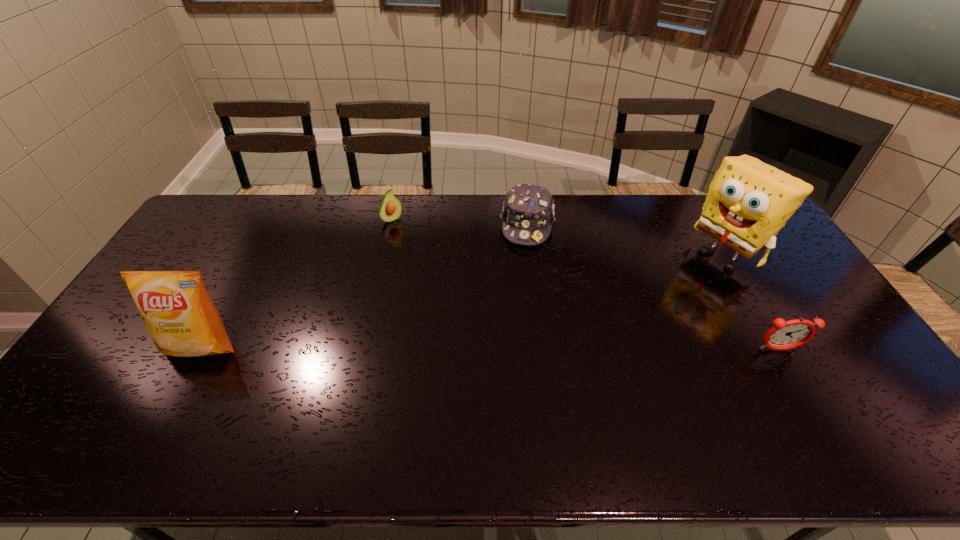
This screenshot has width=960, height=540. In order to click on the second tallest object in this screenshot , I will do `click(175, 306)`.

Where is `crisp (potato chip)`? This screenshot has height=540, width=960. crisp (potato chip) is located at coordinates (175, 306).

Where is `alarm clock`? alarm clock is located at coordinates (785, 335).

Image resolution: width=960 pixels, height=540 pixels. I want to click on avocado, so click(390, 208).

Image resolution: width=960 pixels, height=540 pixels. In order to click on the tallest object in this screenshot , I will do (x=748, y=202).

Where is `the third object from left to right`? the third object from left to right is located at coordinates click(528, 212).

Find the location of a particular element. This screenshot has width=960, height=540. vacant space located on the front-facing side of the second tallest object is located at coordinates (176, 395).

Locate an element on the screen. This screenshot has width=960, height=540. free region located 0.110m on the front-facing side of the alarm clock is located at coordinates click(x=802, y=390).

The width and height of the screenshot is (960, 540). I want to click on free spot located 0.060m on the cut side of the second object from left to right, so click(x=405, y=233).

Locate an element on the screen. vacant area situated 0.070m on the cut side of the second object from left to right is located at coordinates (407, 235).